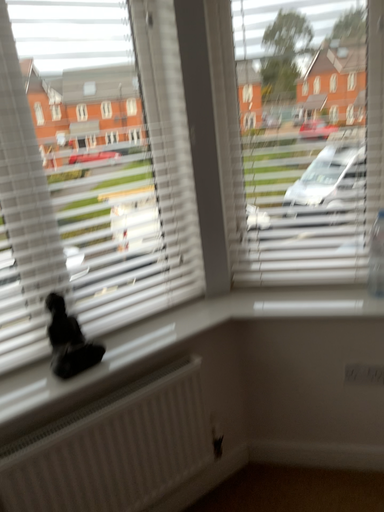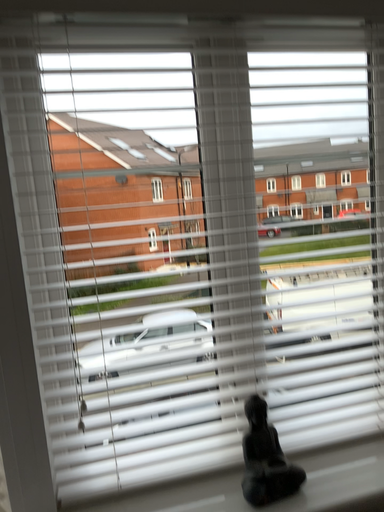
Question: Which way did the camera rotate in the video?

Choices:
 (A) rotated downward
 (B) rotated upward

Answer: (B)